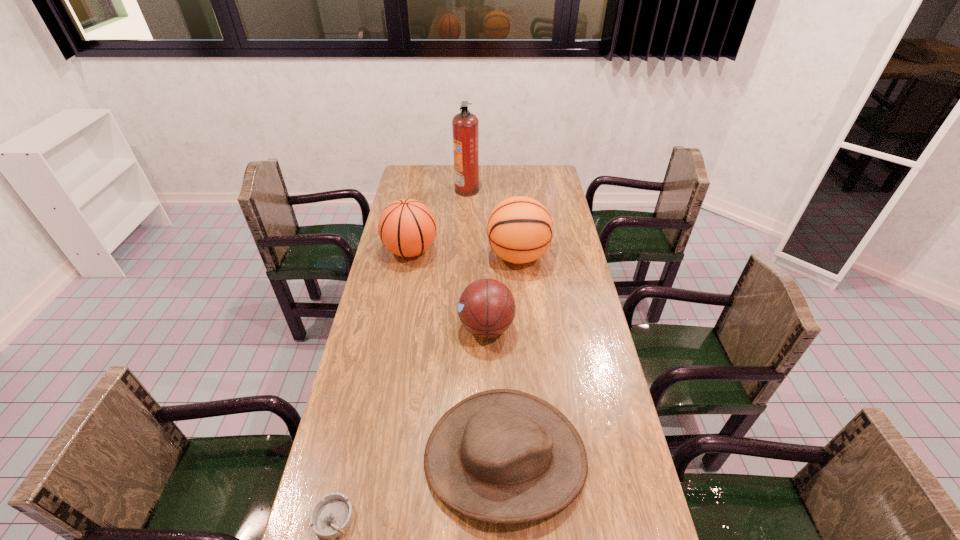
Identify the location of vacant area that lies between the third nearest object and the leftmost basketball. This screenshot has width=960, height=540. (448, 289).

Find the location of a particular element. object that stands as the fourth closest to the shortest object is located at coordinates (520, 229).

Where is `object that is the third closest to the tallest object`? object that is the third closest to the tallest object is located at coordinates (486, 308).

Image resolution: width=960 pixels, height=540 pixels. Find the location of `the second closest basketball to the fire extinguisher`. the second closest basketball to the fire extinguisher is located at coordinates (520, 229).

Identify the location of the closest basketball relative to the nearest basketball. The image size is (960, 540). (520, 229).

Locate an element on the screen. Image resolution: width=960 pixels, height=540 pixels. free space in the image that satisfies the following two spatial constraints: 1. at the nozzle of the cowboy hat; 2. on the right side of the fire extinguisher is located at coordinates click(456, 457).

You are a GUI agent. You are given a task and a screenshot of the screen. Output one action in this format:
    pyautogui.click(x=<x>, y=<y>)
    Task: Click on the free space that satisfies the following two spatial constraints: 1. on the front side of the cowboy hat; 2. on the right side of the leftmost basketball
    
    Given the screenshot: What is the action you would take?
    pyautogui.click(x=372, y=457)